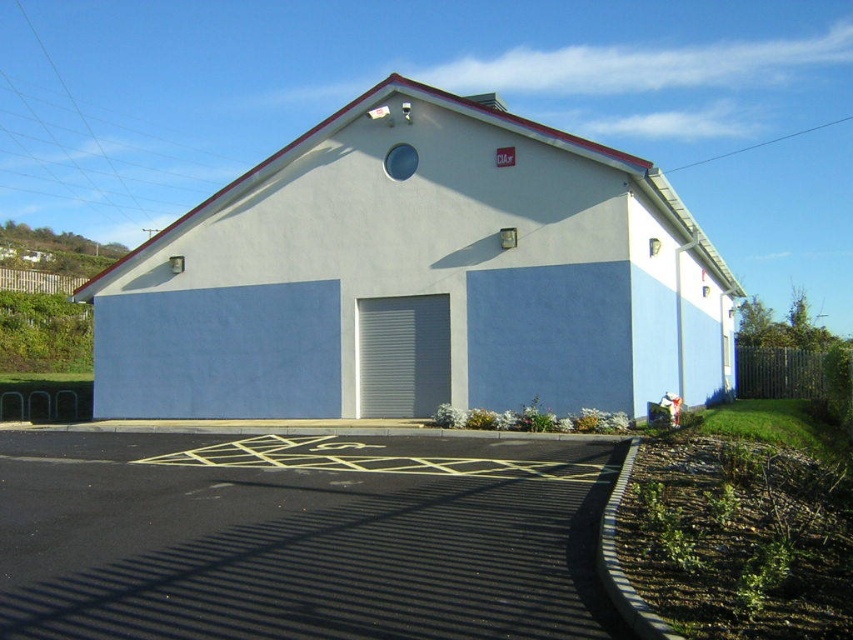
Between point (390, 243) and point (427, 314), which one is positioned in front?

Point (427, 314) is more forward.

Which is behind, point (686, 227) or point (424, 396)?

The point (686, 227) is behind.

Identify the location of white matte garage door at center. Image resolution: width=853 pixels, height=640 pixels. (416, 276).